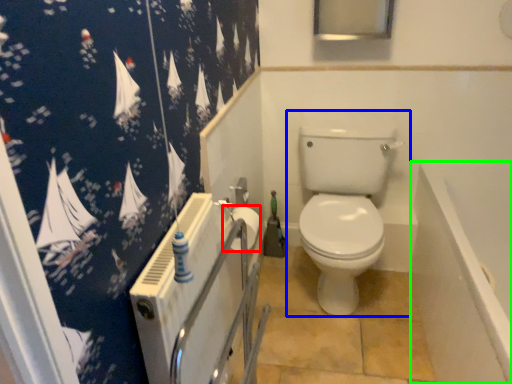
Question: Which object is positioned closest to toilet paper (highlighted by a red box)? Select from toilet (highlighted by a blue box) and bath (highlighted by a green box).

Choices:
 (A) toilet
 (B) bath

Answer: (A)